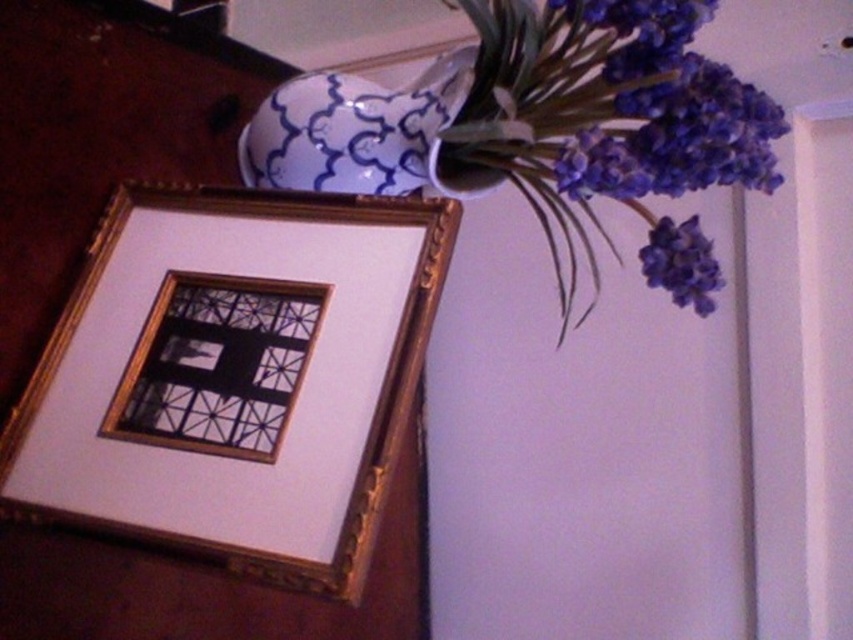
Can you confirm if gold/gilded picture frame at upper left is taller than purple matte flowers at upper right?

Correct, gold/gilded picture frame at upper left is much taller as purple matte flowers at upper right.

Which is in front, point (274, 577) or point (573, 164)?

Point (274, 577)

You are a GUI agent. You are given a task and a screenshot of the screen. Output one action in this format:
    pyautogui.click(x=<x>, y=<y>)
    Task: Click on the gold/gilded picture frame at upper left
    Image resolution: width=853 pixels, height=640 pixels.
    Given the screenshot: What is the action you would take?
    click(x=233, y=378)

Which of these two, blue and white porcelain vase at upper right or matte purple flower at upper right, stands taller?

blue and white porcelain vase at upper right

Which is above, blue and white porcelain vase at upper right or matte purple flower at upper right?

Positioned higher is blue and white porcelain vase at upper right.

Is point (297, 131) closer to viewer compared to point (683, 243)?

No, it is not.

This screenshot has width=853, height=640. In order to click on blue and white porcelain vase at upper right in this screenshot , I will do `click(363, 134)`.

Who is more forward, (258,134) or (352,106)?

Positioned in front is point (352,106).

Is point (268, 156) farther from camera compared to point (381, 128)?

Yes.

Locate an element on the screen. The height and width of the screenshot is (640, 853). blue glossy vase at upper right is located at coordinates (535, 113).